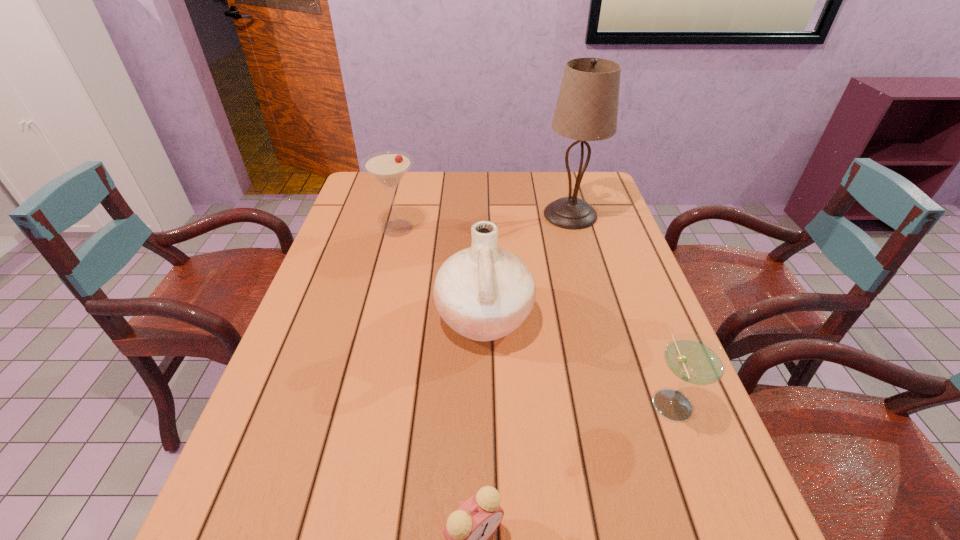
Where is `free space located to pour from the handle of the pottery`? Image resolution: width=960 pixels, height=540 pixels. free space located to pour from the handle of the pottery is located at coordinates (357, 318).

The width and height of the screenshot is (960, 540). I want to click on free space located 0.140m to pour from the handle of the pottery, so click(x=378, y=318).

Where is `vacant space located on the front of the taller martini`? vacant space located on the front of the taller martini is located at coordinates (370, 341).

At what (x,y) coordinates should I click in order to perform the action: click on free space located on the back of the second nearest object. Please return your answer as a coordinate pair (x, y). Looking at the image, I should click on (622, 269).

Identify the location of object at the far edge. (587, 107).

Identify the location of object situated at the left edge. This screenshot has height=540, width=960. (388, 167).

I want to click on lampshade situated at the right edge, so click(587, 107).

The height and width of the screenshot is (540, 960). What are the coordinates of `martini present at the right edge` in the screenshot? It's located at (694, 359).

Find the location of a particular element. object that is at the far right corner is located at coordinates (587, 107).

Locate an element on the screen. This screenshot has width=960, height=540. vacant region at the far edge of the desktop is located at coordinates (533, 199).